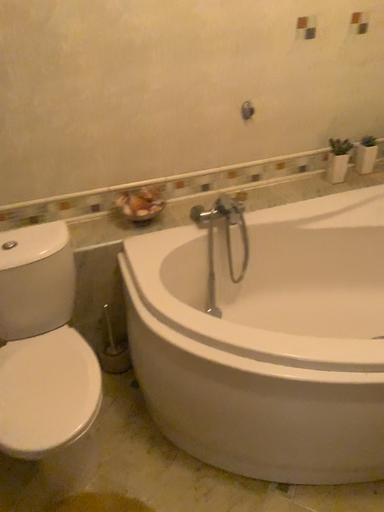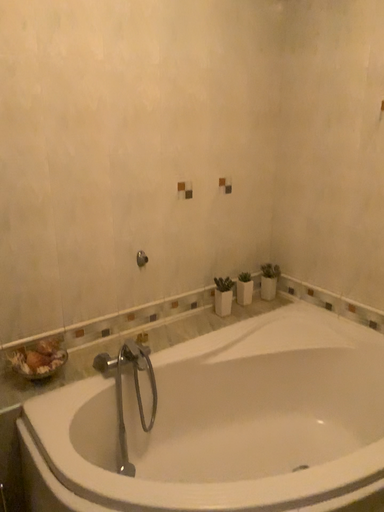
Question: How did the camera likely rotate when shooting the video?

Choices:
 (A) rotated left
 (B) rotated right

Answer: (B)